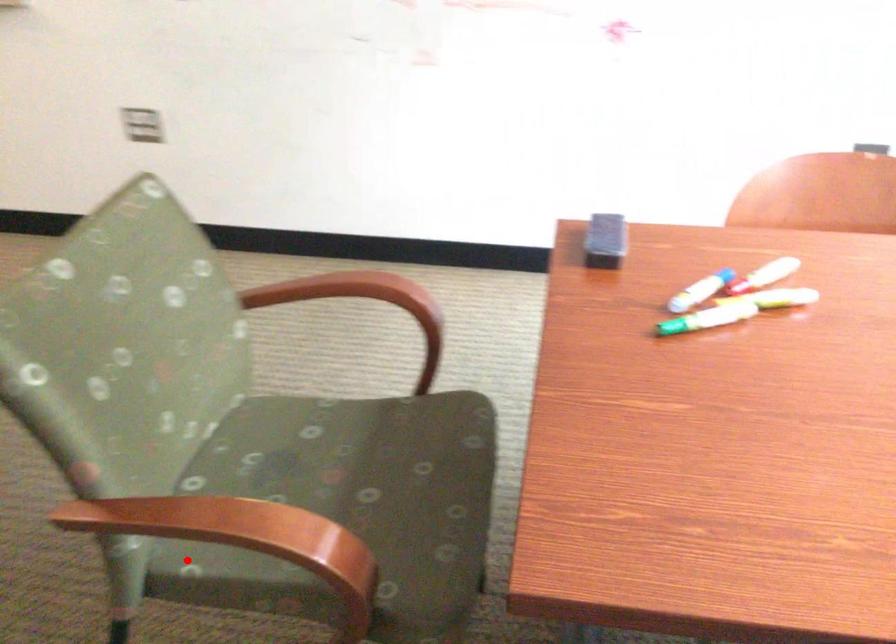
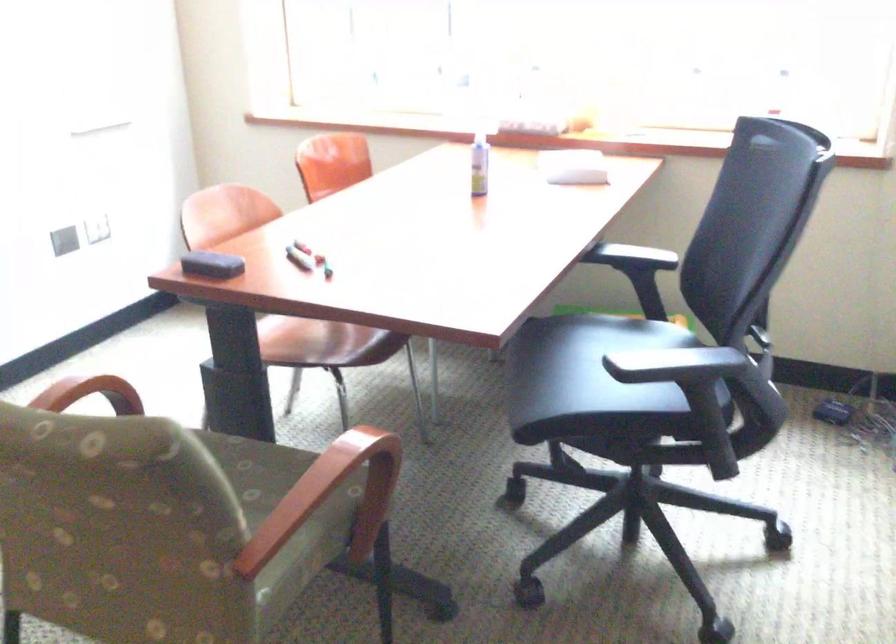
The point at the highlighted location is marked in the first image. Where is the corresponding point in the second image?

(331, 496)